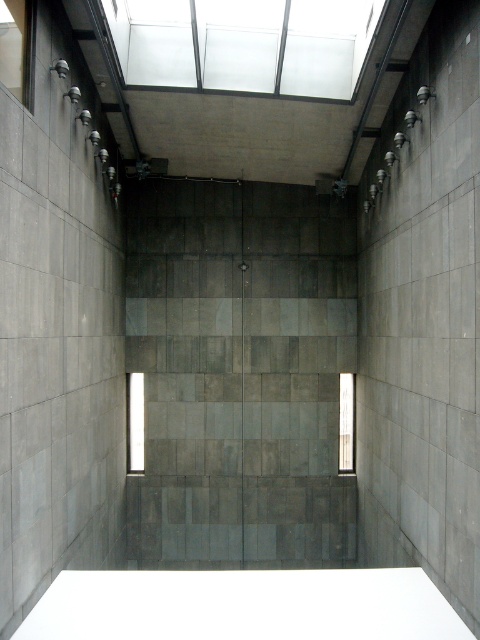
Can you confirm if transparent glass window at upper left is smaller than clear glass window at center?

Yes.

Is the position of transparent glass window at upper left less distant than that of clear glass window at center?

Yes, transparent glass window at upper left is closer to the viewer.

The height and width of the screenshot is (640, 480). I want to click on transparent glass window at upper left, so tap(17, 49).

The height and width of the screenshot is (640, 480). In order to click on transparent glass window at upper left in this screenshot , I will do `click(17, 49)`.

Can you confirm if transparent glass skylight at upper center is shorter than transparent glass window at center?

Correct, transparent glass skylight at upper center is not as tall as transparent glass window at center.

This screenshot has width=480, height=640. In order to click on transparent glass skylight at upper center in this screenshot , I will do `click(244, 44)`.

At what (x,y) coordinates should I click in order to perform the action: click on transparent glass skylight at upper center. Please return your answer as a coordinate pair (x, y). The height and width of the screenshot is (640, 480). Looking at the image, I should click on (244, 44).

Locate an element on the screen. The height and width of the screenshot is (640, 480). transparent glass skylight at upper center is located at coordinates (244, 44).

Does transparent glass window at upper left have a greater width compared to transparent glass window at center?

→ Incorrect, transparent glass window at upper left's width does not surpass transparent glass window at center's.

Can you confirm if transparent glass window at upper left is shorter than transparent glass window at center?

Yes, transparent glass window at upper left is shorter than transparent glass window at center.

Is point (14, 77) behind point (136, 458)?

No, (14, 77) is closer to viewer.

Where is `transparent glass window at upper left`? Image resolution: width=480 pixels, height=640 pixels. transparent glass window at upper left is located at coordinates (17, 49).